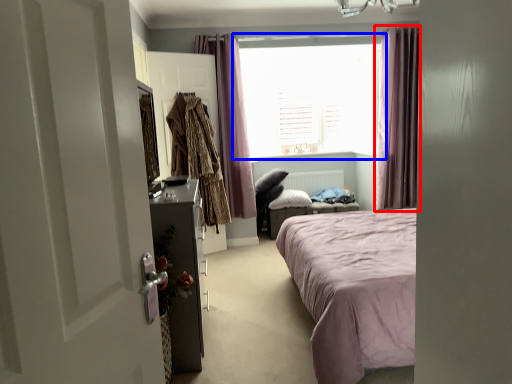
Question: Which object is closer to the camera taking this photo, curtain (highlighted by a red box) or window (highlighted by a blue box)?

Choices:
 (A) curtain
 (B) window

Answer: (A)